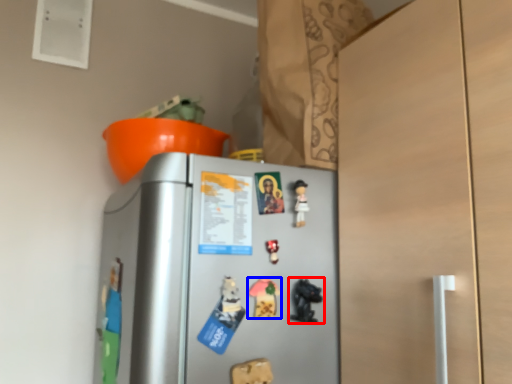
Question: Which of the following is the farthest to the observer, toy (highlighted by a red box) or toy (highlighted by a blue box)?

Choices:
 (A) toy
 (B) toy

Answer: (A)